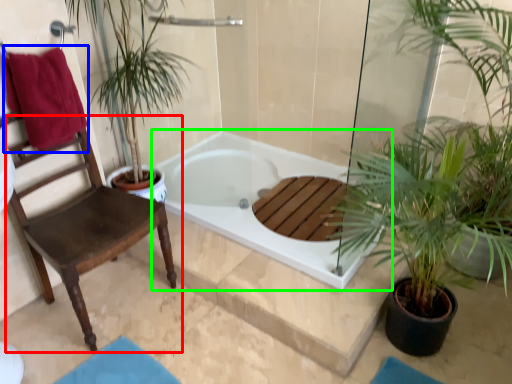
Question: Based on their relative distances, which object is farther from chair (highlighted by a red box)? Choose from beach towel (highlighted by a blue box) and bathtub (highlighted by a green box).

Choices:
 (A) beach towel
 (B) bathtub

Answer: (B)